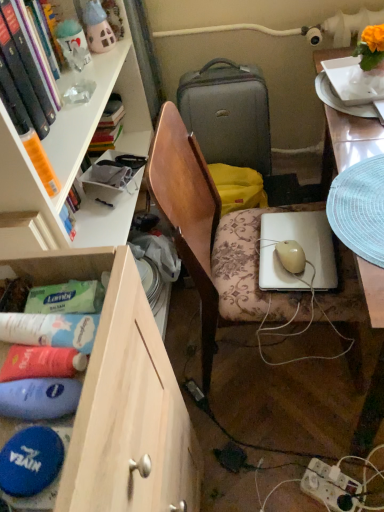
Locate an element on the screen. matte gray suitcase at center is located at coordinates (228, 113).

The height and width of the screenshot is (512, 384). Describe the element at coordinates (24, 70) in the screenshot. I see `hardcover book at upper left` at that location.

The height and width of the screenshot is (512, 384). I want to click on white plastic power outlet at lower right, so click(330, 486).

The image size is (384, 512). What do you see at coordinates (103, 306) in the screenshot? I see `wooden drawer at lower left` at bounding box center [103, 306].

What do you see at coordinates (348, 142) in the screenshot? The width and height of the screenshot is (384, 512). I see `white glossy plate at upper right` at bounding box center [348, 142].

Identify the location of wooden chair at center. (211, 239).

Locate an element on the screen. The height and width of the screenshot is (512, 384). white glossy desk at right is located at coordinates (347, 143).

The height and width of the screenshot is (512, 384). I want to click on matte gray suitcase at center, so click(228, 113).

Is white plastic power outlet at lower right completely or partially outside of white glossy desk at right?

Yes, white plastic power outlet at lower right is outside of white glossy desk at right.

Is white plastic power outlet at lower right taller than white glossy desk at right?

No.

How different are the orientations of white plastic power outlet at lower right and white glossy desk at right in degrees?

They differ by 118 degrees in their facing directions.

Which is more to the left, white plastic power outlet at lower right or white glossy desk at right?

white plastic power outlet at lower right.

Is the surface of wooden drawer at lower left in direct contact with matte gray suitcase at center?

There is a gap between wooden drawer at lower left and matte gray suitcase at center.

From the image's perspective, is wooden drawer at lower left under matte gray suitcase at center?

Correct, wooden drawer at lower left appears lower than matte gray suitcase at center in the image.

What are the coordinates of `cabinetry below the matte gray suitcase at center (from a real-world perspective)` in the screenshot? It's located at (103, 306).

Can you confirm if wooden drawer at lower left is shorter than white plastic power outlet at lower right?

Incorrect, the height of wooden drawer at lower left does not fall short of that of white plastic power outlet at lower right.

Can white plastic power outlet at lower right be found inside wooden drawer at lower left?

No, white plastic power outlet at lower right is not inside wooden drawer at lower left.

From the image's perspective, does wooden drawer at lower left appear higher than white plastic power outlet at lower right?

Yes, from the image's perspective, wooden drawer at lower left is on top of white plastic power outlet at lower right.

Does wooden drawer at lower left appear on the left side of white plastic power outlet at lower right?

Yes, wooden drawer at lower left is to the left of white plastic power outlet at lower right.

Is hardcover book at upper left facing towards white glossy plate at upper right?

Yes, hardcover book at upper left is facing white glossy plate at upper right.

Can we say hardcover book at upper left lies outside white glossy plate at upper right?

hardcover book at upper left lies outside white glossy plate at upper right's area.

Does point (29, 109) come closer to viewer compared to point (331, 169)?

Yes.

Considering the sizes of objects hardcover book at upper left and white glossy plate at upper right in the image provided, who is smaller, hardcover book at upper left or white glossy plate at upper right?

With smaller size is white glossy plate at upper right.

Is wooden chair at center wider or thinner than wooden drawer at lower left?

wooden chair at center is thinner than wooden drawer at lower left.

Locate an element on the screen. cabinetry below the wooden chair at center (from the image's perspective) is located at coordinates (103, 306).

Relative to wooden drawer at lower left, is wooden chair at center in front or behind?

Clearly, wooden chair at center is behind wooden drawer at lower left.

In terms of height, does white plastic power outlet at lower right look taller or shorter compared to wooden drawer at lower left?

Considering their sizes, white plastic power outlet at lower right has less height than wooden drawer at lower left.

Are white plastic power outlet at lower right and wooden drawer at lower left beside each other?

white plastic power outlet at lower right and wooden drawer at lower left are not in contact.

From the picture: Is white plastic power outlet at lower right behind wooden drawer at lower left?

Yes, the depth of white plastic power outlet at lower right is greater than that of wooden drawer at lower left.

Is white plastic power outlet at lower right wider than wooden drawer at lower left?

In fact, white plastic power outlet at lower right might be narrower than wooden drawer at lower left.

From a real-world perspective, does white glossy plate at upper right sit lower than white glossy desk at right?

No, from a real-world perspective, white glossy plate at upper right is not below white glossy desk at right.

Is white glossy plate at upper right touching white glossy desk at right?

Yes, white glossy plate at upper right is right next to white glossy desk at right and making contact.

Measure the distance from white glossy plate at upper right to white glossy desk at right.

white glossy plate at upper right and white glossy desk at right are 0.31 inches apart from each other.

The image size is (384, 512). Find the location of `desk below the white glossy plate at upper right (from a real-world perspective)`. desk below the white glossy plate at upper right (from a real-world perspective) is located at coordinates (347, 143).

At what (x,y) coordinates should I click in order to perform the action: click on desk in front of the white plastic power outlet at lower right. Please return your answer as a coordinate pair (x, y). The image size is (384, 512). Looking at the image, I should click on (347, 143).

Locate an element on the screen. Image resolution: width=384 pixels, height=512 pixels. suitcase on the right of wooden drawer at lower left is located at coordinates (228, 113).

Considering their positions, is white glossy plate at upper right positioned further to wooden chair at center than white glossy desk at right?

white glossy plate at upper right is further to wooden chair at center.

From the image, which object appears to be nearer to white plastic power outlet at lower right, white glossy desk at right or white glossy plate at upper right?

Among the two, white glossy desk at right is located nearer to white plastic power outlet at lower right.

Looking at the image, which one is located further to white plastic power outlet at lower right, matte gray suitcase at center or wooden drawer at lower left?

Among the two, matte gray suitcase at center is located further to white plastic power outlet at lower right.

Which object lies nearer to the anchor point white glossy plate at upper right, matte gray suitcase at center or wooden drawer at lower left?

matte gray suitcase at center is closer to white glossy plate at upper right.

From the image, which object appears to be nearer to wooden chair at center, white glossy plate at upper right or matte gray suitcase at center?

white glossy plate at upper right is closer to wooden chair at center.

From the image, which object appears to be farther from white glossy desk at right, white glossy plate at upper right or white plastic power outlet at lower right?

white plastic power outlet at lower right is positioned further to the anchor white glossy desk at right.

Based on the photo, estimate the real-world distances between objects in this image. Which object is further from white plastic power outlet at lower right, white glossy desk at right or wooden drawer at lower left?

Among the two, white glossy desk at right is located further to white plastic power outlet at lower right.

From the image, which object appears to be nearer to wooden drawer at lower left, matte gray suitcase at center or wooden chair at center?

wooden chair at center.

What are the coordinates of `suitcase between hardcover book at upper left and white glossy desk at right in the horizontal direction` in the screenshot? It's located at (228, 113).

Identify the location of table top that lies between hardcover book at upper left and white plastic power outlet at lower right from top to bottom. This screenshot has height=512, width=384. (348, 142).

Identify the location of desk between matte gray suitcase at center and white plastic power outlet at lower right vertically. (347, 143).

This screenshot has width=384, height=512. Find the location of `table top between hardcover book at upper left and wooden drawer at lower left vertically`. table top between hardcover book at upper left and wooden drawer at lower left vertically is located at coordinates (348, 142).